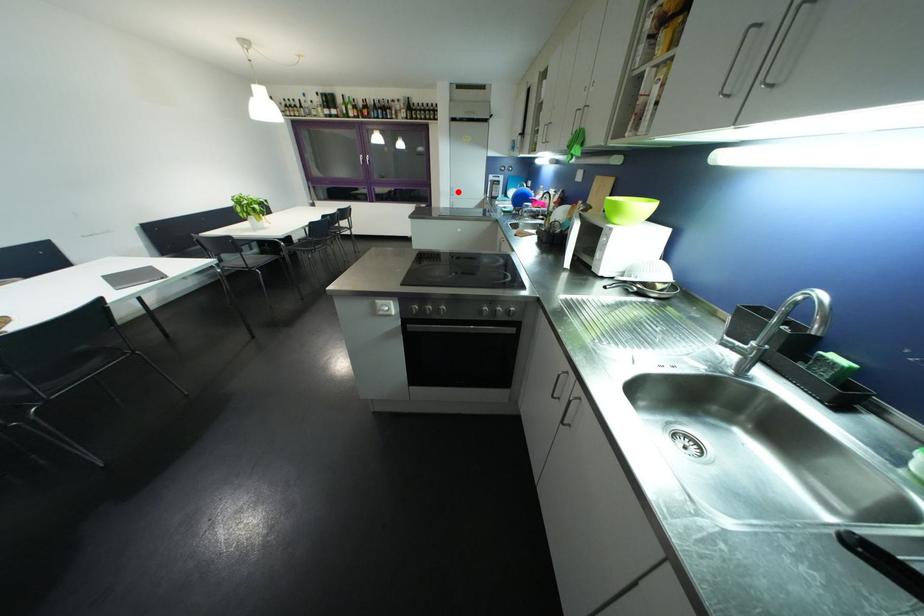
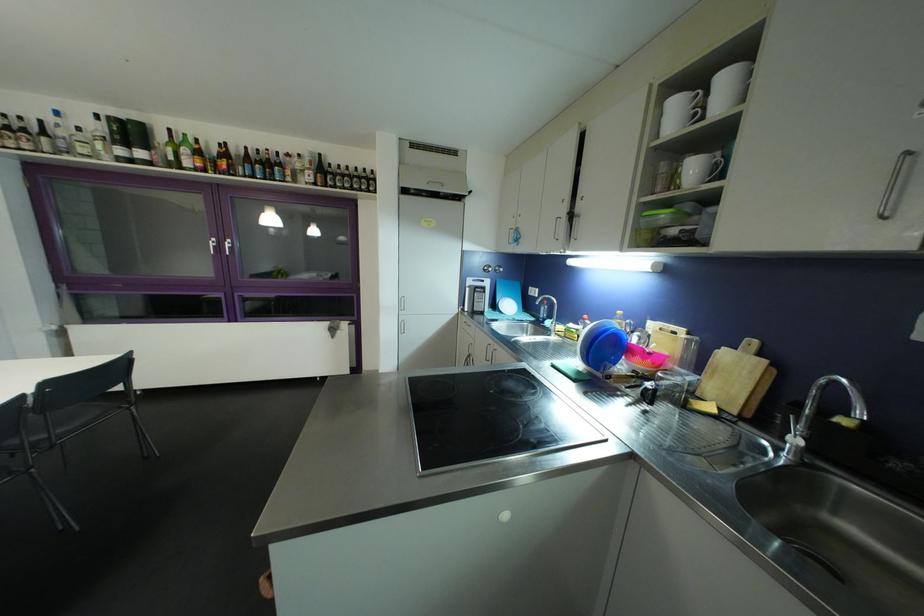
Question: I am providing you with two images of the same scene from different viewpoints. Given a red point in image1, look at the same physical point in image2. Is it:

Choices:
 (A) Closer to the viewpoint
 (B) Farther from the viewpoint

Answer: (B)